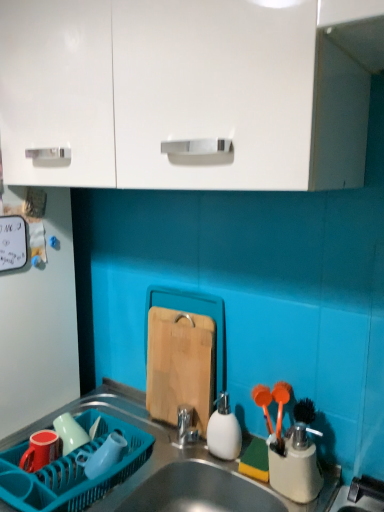
Question: From a real-world perspective, is translucent blue plastic cup at lower left, positioned as the third tableware in left-to-right order, physically below teal plastic dish rack at lower left?

Choices:
 (A) no
 (B) yes

Answer: (A)

Question: From the image's perspective, does translucent blue plastic cup at lower left, arranged as the 2th tableware when viewed from the right, appear higher than teal plastic dish rack at lower left?

Choices:
 (A) yes
 (B) no

Answer: (A)

Question: Is teal plastic dish rack at lower left a part of translucent blue plastic cup at lower left, positioned as the third tableware in left-to-right order?

Choices:
 (A) no
 (B) yes

Answer: (A)

Question: Is translucent blue plastic cup at lower left, arranged as the 2th tableware when viewed from the right, taller than teal plastic dish rack at lower left?

Choices:
 (A) no
 (B) yes

Answer: (A)

Question: Can you confirm if translucent blue plastic cup at lower left, positioned as the third tableware in left-to-right order, is smaller than teal plastic dish rack at lower left?

Choices:
 (A) yes
 (B) no

Answer: (A)

Question: In terms of height, does translucent blue plastic cup at lower left, arranged as the 2th tableware when viewed from the right, look taller or shorter compared to matte green cup at left, which is the third tableware in right-to-left order?

Choices:
 (A) short
 (B) tall

Answer: (B)

Question: In terms of width, does translucent blue plastic cup at lower left, arranged as the 2th tableware when viewed from the right, look wider or thinner when compared to matte green cup at left, which is the second tableware from left to right?

Choices:
 (A) thin
 (B) wide

Answer: (B)

Question: From a real-world perspective, is translucent blue plastic cup at lower left, arranged as the 2th tableware when viewed from the right, above or below matte green cup at left, which is the third tableware in right-to-left order?

Choices:
 (A) below
 (B) above

Answer: (B)

Question: Considering their positions, is translucent blue plastic cup at lower left, arranged as the 2th tableware when viewed from the right, located in front of or behind matte green cup at left, which is the third tableware in right-to-left order?

Choices:
 (A) front
 (B) behind

Answer: (A)

Question: Does point (215, 440) appear closer or farther from the camera than point (69, 428)?

Choices:
 (A) farther
 (B) closer

Answer: (B)

Question: Visually, is white matte soap dispenser at center, which is the 4th tableware from left to right, positioned to the left or to the right of matte green cup at left, which is the third tableware in right-to-left order?

Choices:
 (A) right
 (B) left

Answer: (A)

Question: Considering their positions, is white matte soap dispenser at center, which is the 4th tableware from left to right, located in front of or behind matte green cup at left, which is the second tableware from left to right?

Choices:
 (A) behind
 (B) front

Answer: (B)

Question: From a real-world perspective, relative to matte green cup at left, which is the second tableware from left to right, is white matte soap dispenser at center, the first tableware when ordered from right to left, vertically above or below?

Choices:
 (A) below
 (B) above

Answer: (B)

Question: Considering the positions of point (314, 501) and point (64, 414), is point (314, 501) closer or farther from the camera than point (64, 414)?

Choices:
 (A) farther
 (B) closer

Answer: (B)

Question: In the image, is metallic stainless steel sink at lower center positioned in front of or behind matte green cup at left, which is the second tableware from left to right?

Choices:
 (A) front
 (B) behind

Answer: (A)